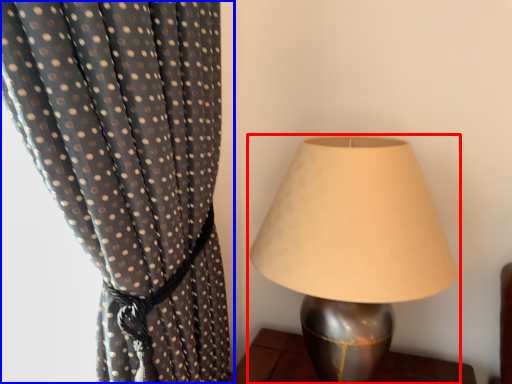
Question: Which object is closer to the camera taking this photo, lamp (highlighted by a red box) or curtain (highlighted by a blue box)?

Choices:
 (A) lamp
 (B) curtain

Answer: (B)